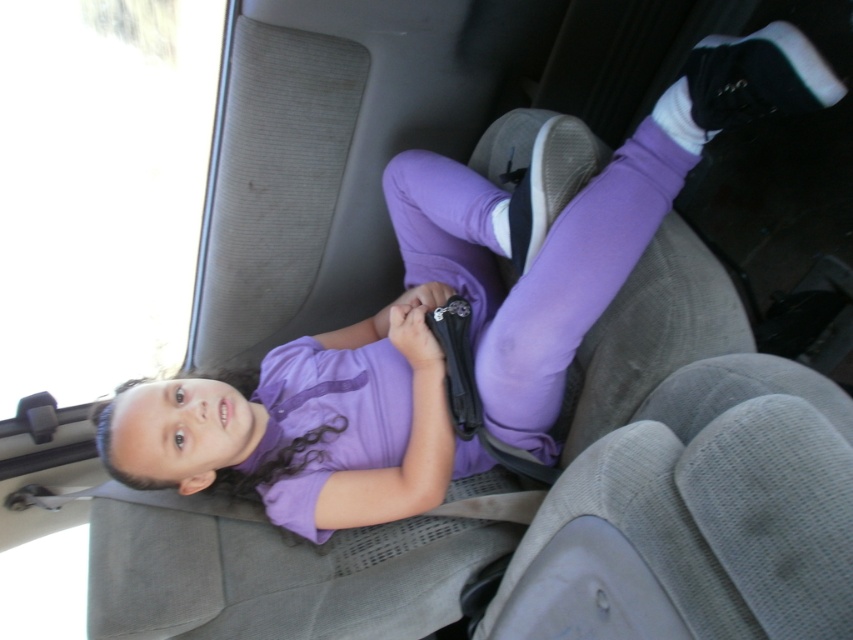
Consider the image. Between purple matte shirt at center and black fabric strap at center, which one appears on the right side from the viewer's perspective?

black fabric strap at center

Is purple matte shirt at center smaller than black fabric strap at center?

Incorrect, purple matte shirt at center is not smaller in size than black fabric strap at center.

I want to click on purple matte shirt at center, so click(467, 323).